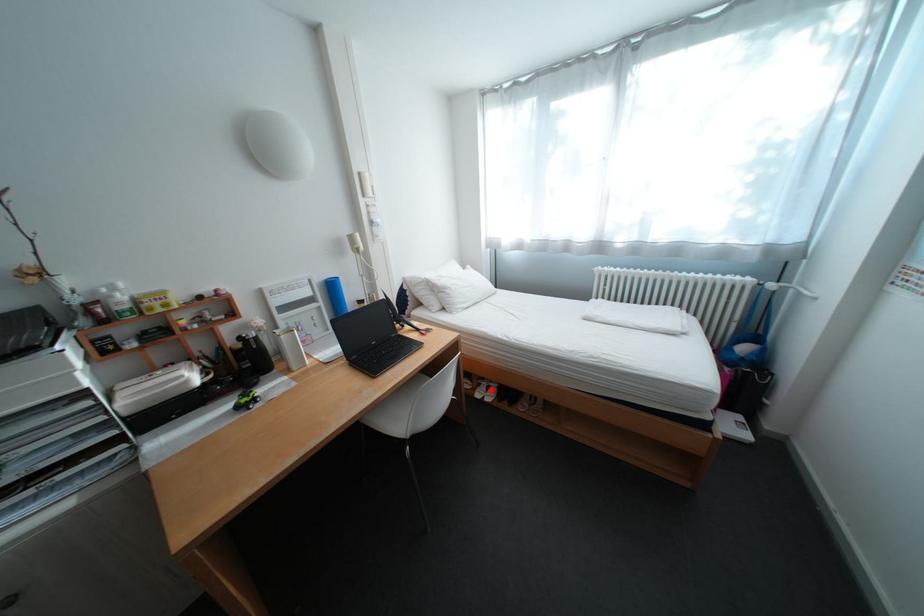
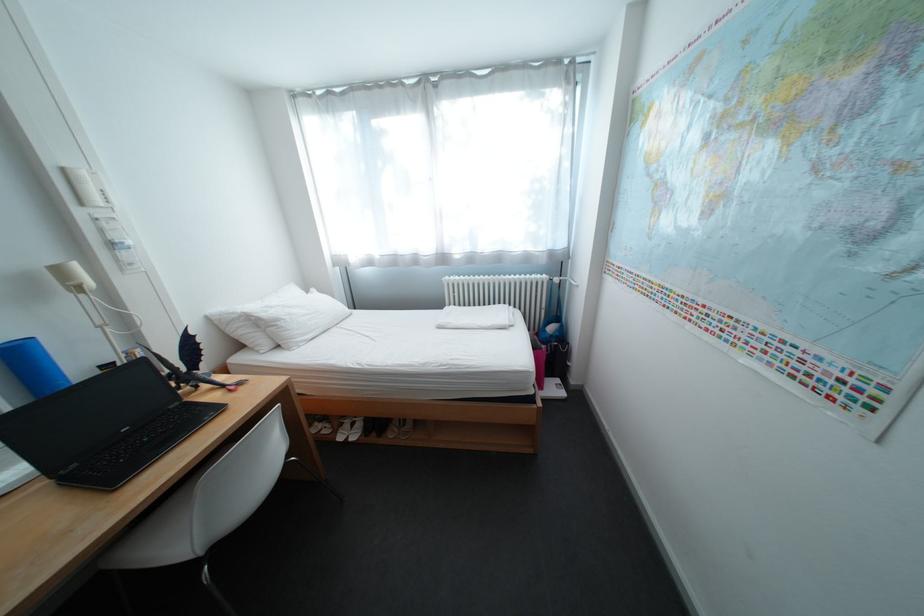
Question: A red point is marked in image1. In image2, is the corresponding 3D point closer to the camera or farther? Reply with the corresponding letter.

Choices:
 (A) The corresponding 3D point is closer.
 (B) The corresponding 3D point is farther.

Answer: (A)